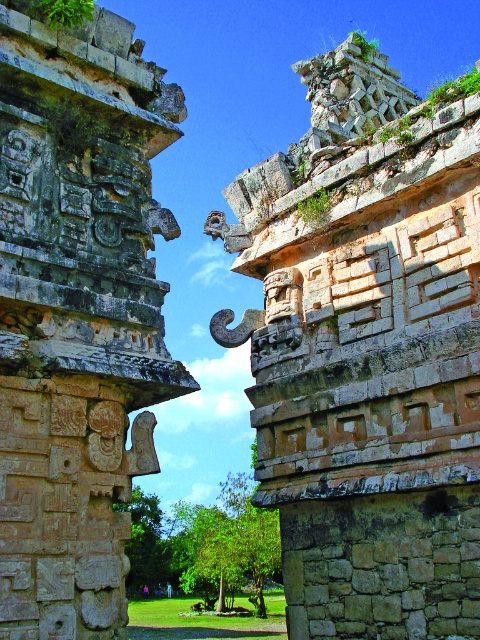
How much distance is there between weathered stone ruins at upper right and gray stone carvings at left?

weathered stone ruins at upper right is 14.19 meters away from gray stone carvings at left.

Between weathered stone ruins at upper right and gray stone carvings at left, which one has less height?

gray stone carvings at left is shorter.

Locate an element on the screen. The image size is (480, 640). weathered stone ruins at upper right is located at coordinates (367, 353).